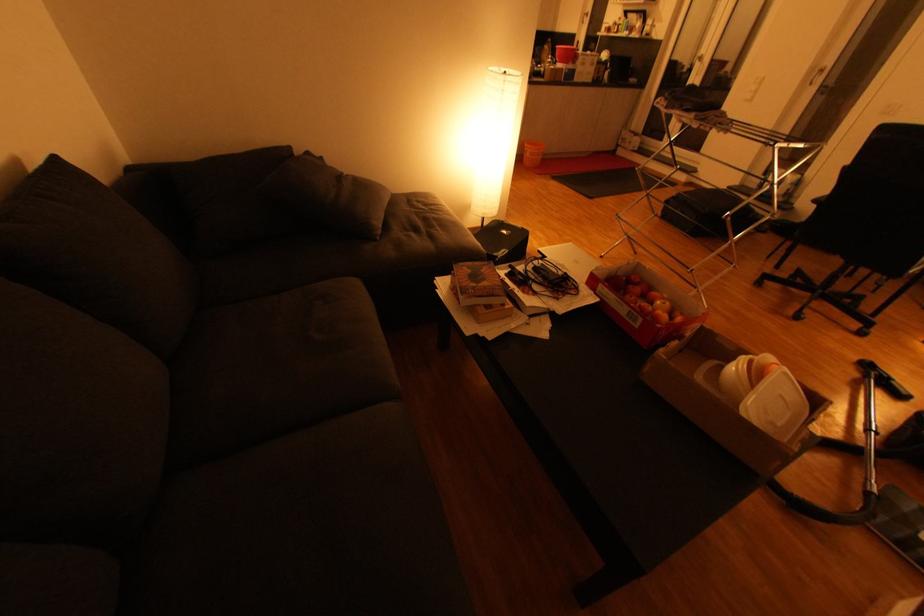
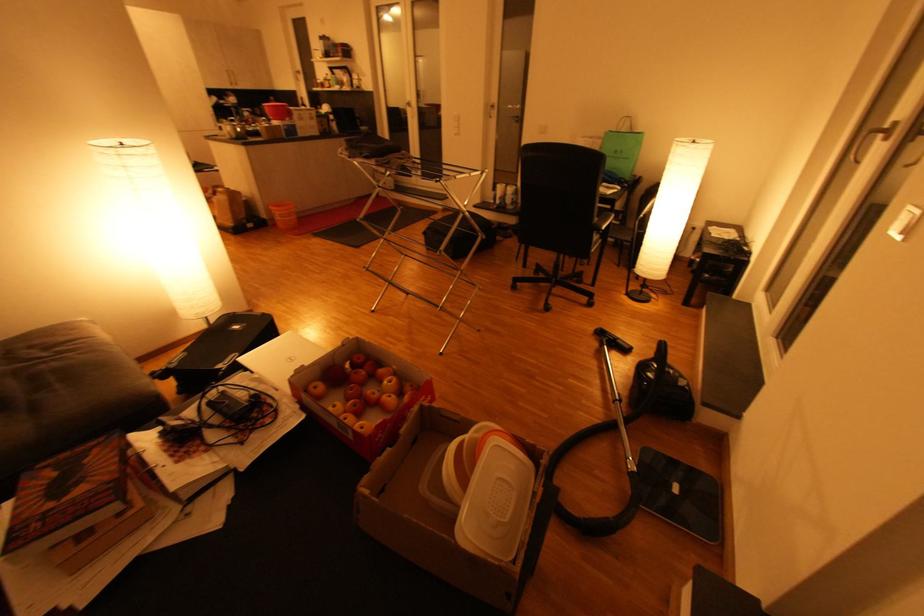
The point at (429,209) is marked in the first image. Where is the corresponding point in the second image?

(47, 355)